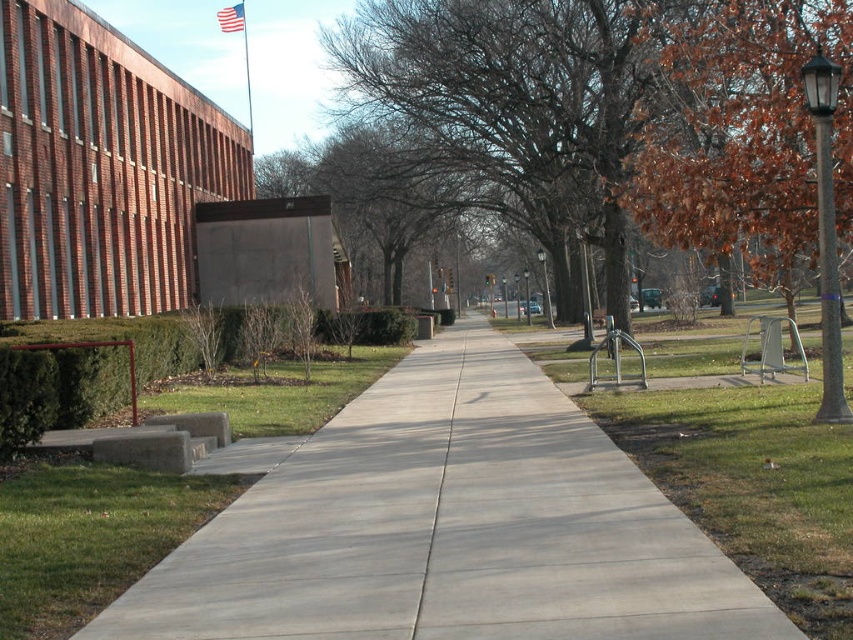
Question: Is gray concrete sidewalk at center to the left of brown leafy tree at right from the viewer's perspective?

Choices:
 (A) no
 (B) yes

Answer: (B)

Question: Does gray concrete sidewalk at center appear under brown leafy tree at right?

Choices:
 (A) no
 (B) yes

Answer: (B)

Question: Which point is closer to the camera taking this photo?

Choices:
 (A) (752, 157)
 (B) (129, 625)

Answer: (B)

Question: Can you confirm if gray concrete sidewalk at center is smaller than brown leafy tree at right?

Choices:
 (A) no
 (B) yes

Answer: (B)